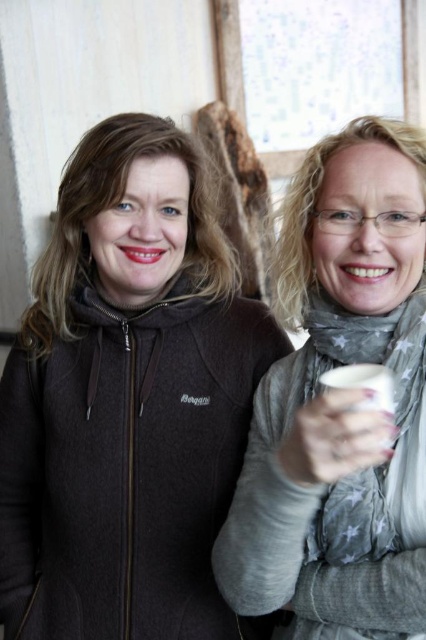
You are standing in the room and want to reach both the point at coordinates (154, 532) and the point at (340, 424). Which point should you approach first to reach the closer one?

The point at coordinates (154, 532) is closer to you than the point at (340, 424), so you should approach it first.

You are standing in a room and see the dark gray fleece jacket at left. If you want to reach it without moving your feet, can you do it?

The dark gray fleece jacket at left is 3.46 feet away from the viewer. Since the average person can reach about 2.5 feet without moving their feet, you would not be able to reach it without moving closer.